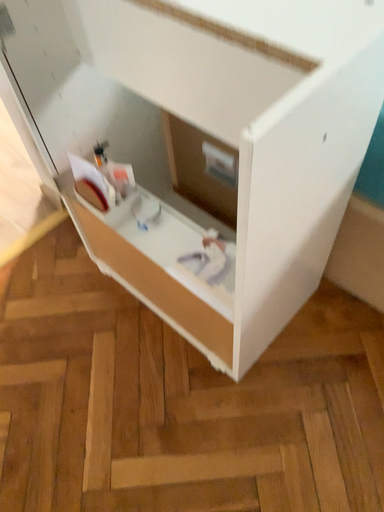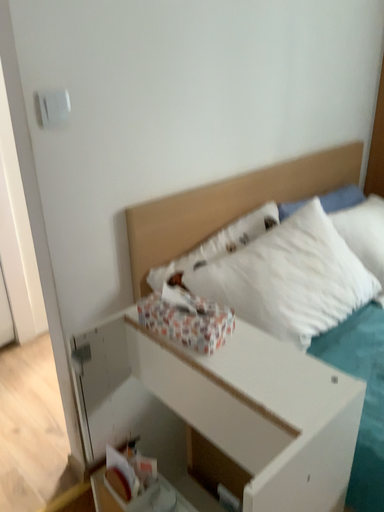
Question: Which way did the camera rotate in the video?

Choices:
 (A) rotated downward
 (B) rotated upward

Answer: (B)